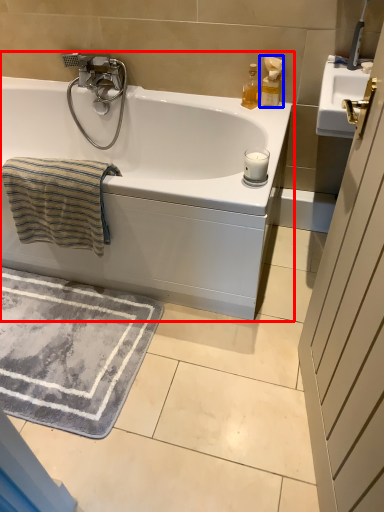
Question: Which point is further to the camera, bathtub (highlighted by a red box) or soap dispenser (highlighted by a blue box)?

Choices:
 (A) bathtub
 (B) soap dispenser

Answer: (B)